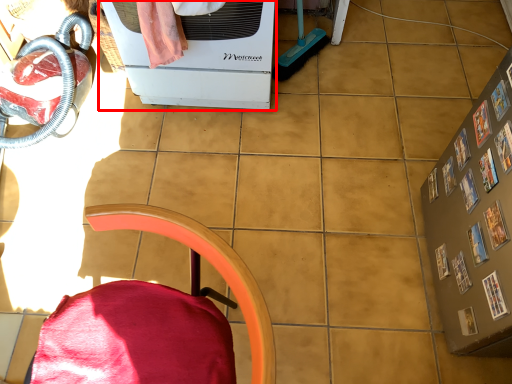
Question: From the image, what is the correct spatial relationship of home appliance (annotated by the red box) in relation to furniture?

Choices:
 (A) right
 (B) left

Answer: (A)